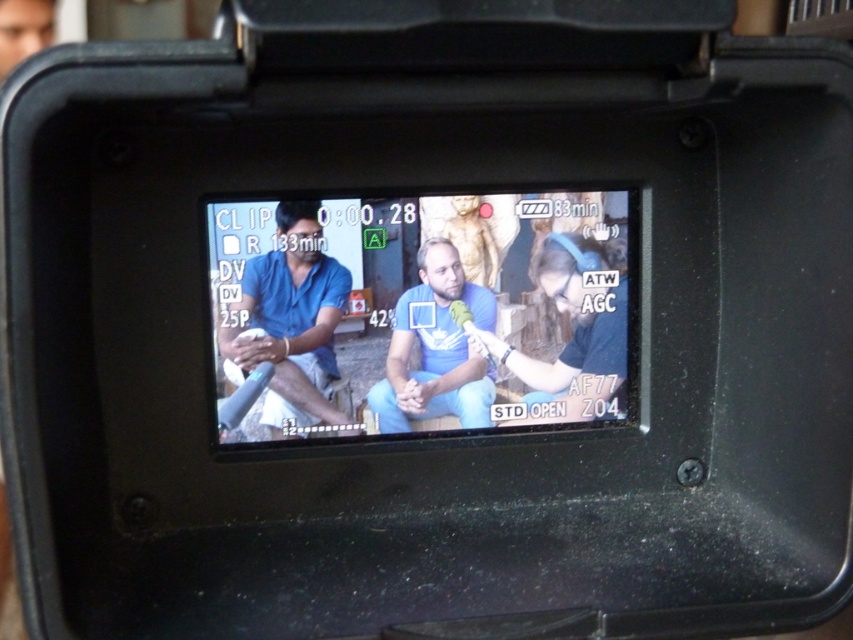
Based on the coordinates provided, which object is located at point [421,310] on the camera screen?

The point [421,310] corresponds to the blue fabric shirt at center.

You are a camera operator trying to focus on the person wearing the blue fabric shirt at center and the blue matte shirt at center in the video feed. Which of these two shirts should you adjust your focus on first if you want to ensure the taller one is in focus?

The blue fabric shirt at center is taller than the blue matte shirt at center, so you should focus on the blue fabric shirt at center first to ensure the taller one is in focus.

Consider the image. You are a camera operator trying to focus on the subject in the center of the screen. Which of the two blue items, the blue fabric shirt at center or the blue denim jeans at center, should you adjust your focus to first to ensure clarity?

The blue fabric shirt at center is closer to the viewer than the blue denim jeans at center, so you should focus on the blue fabric shirt at center first to ensure clarity.